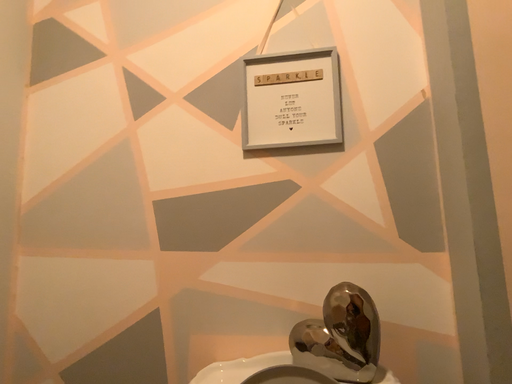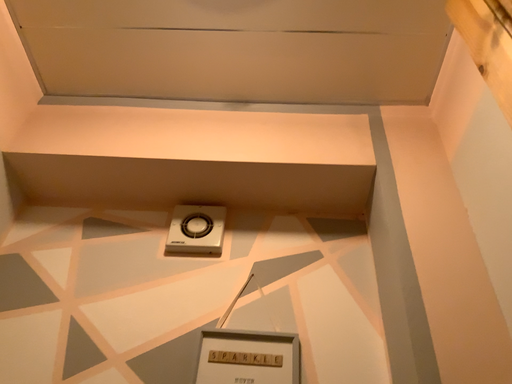
Question: Which way did the camera rotate in the video?

Choices:
 (A) rotated downward
 (B) rotated upward

Answer: (B)